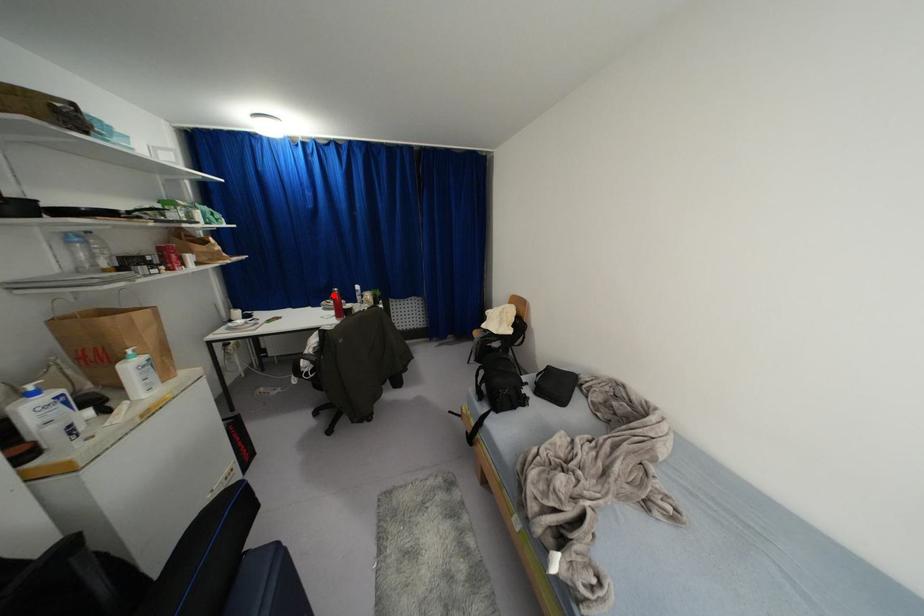
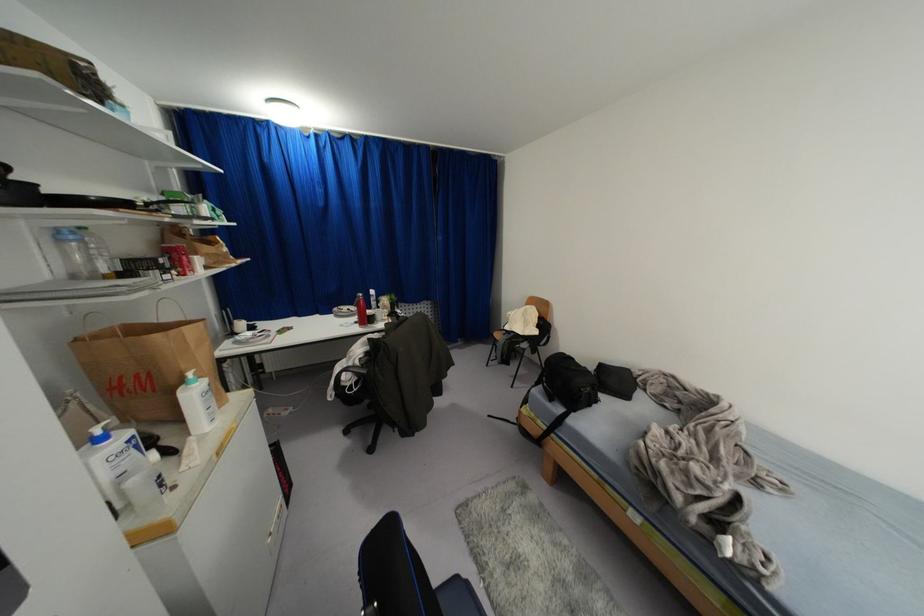
Locate, in the second image, the point that corresponds to the highlighted location in the first image.

(359, 301)